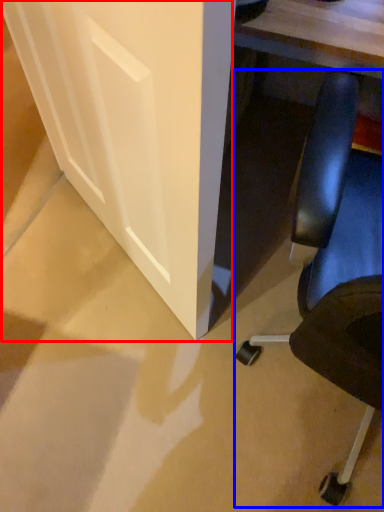
Question: Which of the following is the farthest to the observer, glass door (highlighted by a red box) or chair (highlighted by a blue box)?

Choices:
 (A) glass door
 (B) chair

Answer: (A)